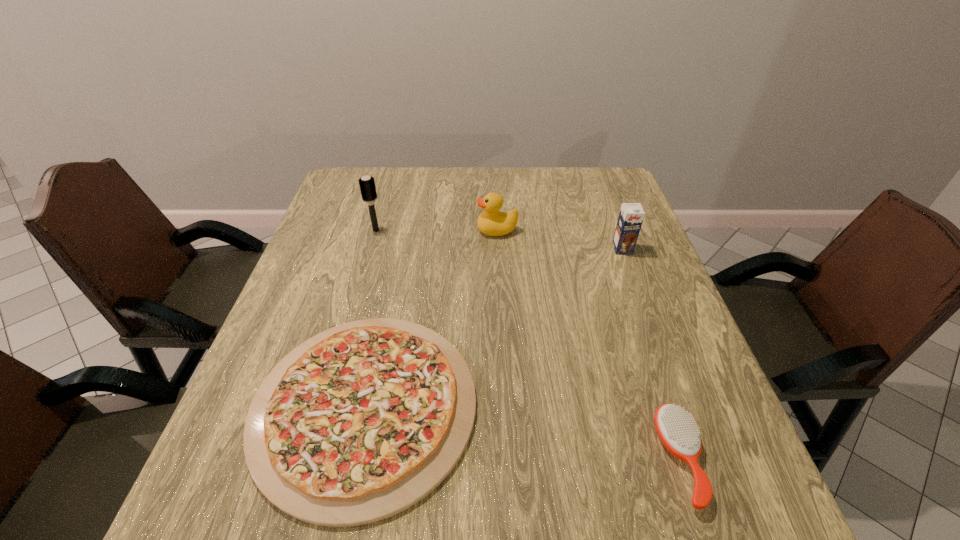
The image size is (960, 540). Identify the location of the farther hairbrush. (367, 185).

At what (x,y) coordinates should I click in order to perform the action: click on the tallest object. Please return your answer as a coordinate pair (x, y). The height and width of the screenshot is (540, 960). Looking at the image, I should click on (367, 185).

Find the location of `chocolate milk`. chocolate milk is located at coordinates (631, 215).

Locate an element on the screen. The width and height of the screenshot is (960, 540). duck is located at coordinates (492, 222).

This screenshot has height=540, width=960. What are the coordinates of `the shorter hairbrush` in the screenshot? It's located at (678, 432).

This screenshot has height=540, width=960. I want to click on the nearer hairbrush, so click(678, 432).

What are the coordinates of `pizza` in the screenshot? It's located at (360, 422).

The image size is (960, 540). What are the coordinates of `free space located 0.150m on the front of the left hairbrush` in the screenshot? It's located at (364, 272).

Locate an element on the screen. The image size is (960, 540). free space located on the front label of the third farthest object is located at coordinates (665, 366).

Where is `free spot located 0.200m at the beak of the third tallest object`? Image resolution: width=960 pixels, height=540 pixels. free spot located 0.200m at the beak of the third tallest object is located at coordinates (405, 230).